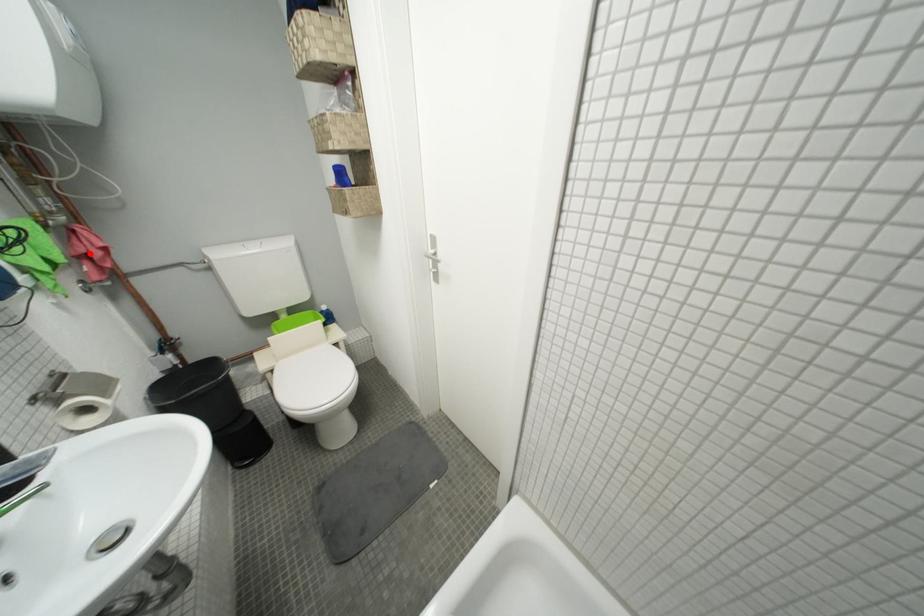
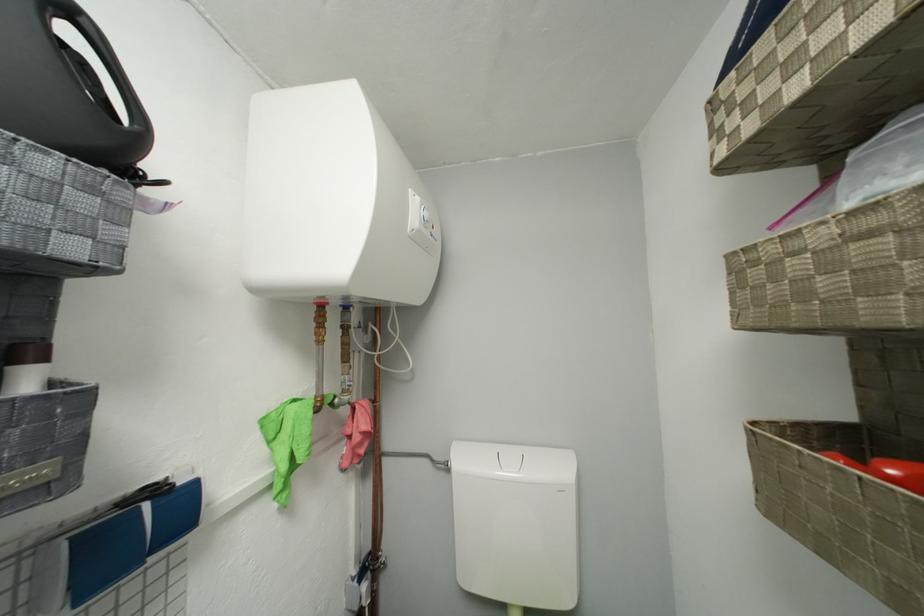
Question: I am providing you with two images of the same scene from different viewpoints. A red point is marked on the first image. Can you still see the location of the red point in image 2?

Choices:
 (A) Yes
 (B) No

Answer: (A)